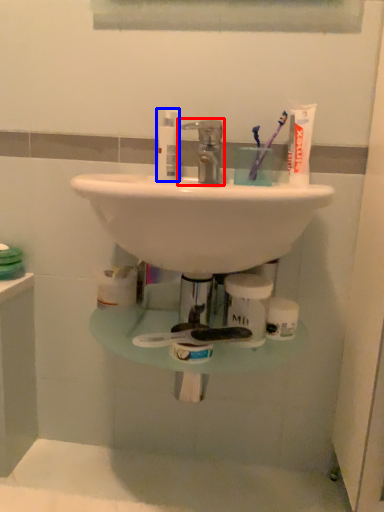
Question: Which point is closer to the camera, tap (highlighted by a red box) or toiletry (highlighted by a blue box)?

Choices:
 (A) tap
 (B) toiletry

Answer: (A)